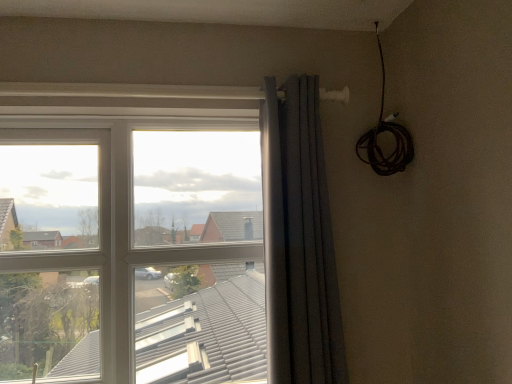
Question: From a real-world perspective, is transparent glass window at center above or below dark gray textured curtain at center?

Choices:
 (A) above
 (B) below

Answer: (B)

Question: Is point pos(31,329) positioned closer to the camera than point pos(300,360)?

Choices:
 (A) closer
 (B) farther

Answer: (B)

Question: Choose the correct answer: Is transparent glass window at center inside dark gray textured curtain at center or outside it?

Choices:
 (A) inside
 (B) outside

Answer: (B)

Question: Based on their sizes in the image, would you say dark gray textured curtain at center is bigger or smaller than transparent glass window at center?

Choices:
 (A) small
 (B) big

Answer: (A)

Question: From the image's perspective, is dark gray textured curtain at center positioned above or below transparent glass window at center?

Choices:
 (A) below
 (B) above

Answer: (B)

Question: Does point pos(289,147) appear closer or farther from the camera than point pos(240,215)?

Choices:
 (A) farther
 (B) closer

Answer: (B)

Question: In terms of width, does dark gray textured curtain at center look wider or thinner when compared to transparent glass window at center?

Choices:
 (A) thin
 (B) wide

Answer: (A)